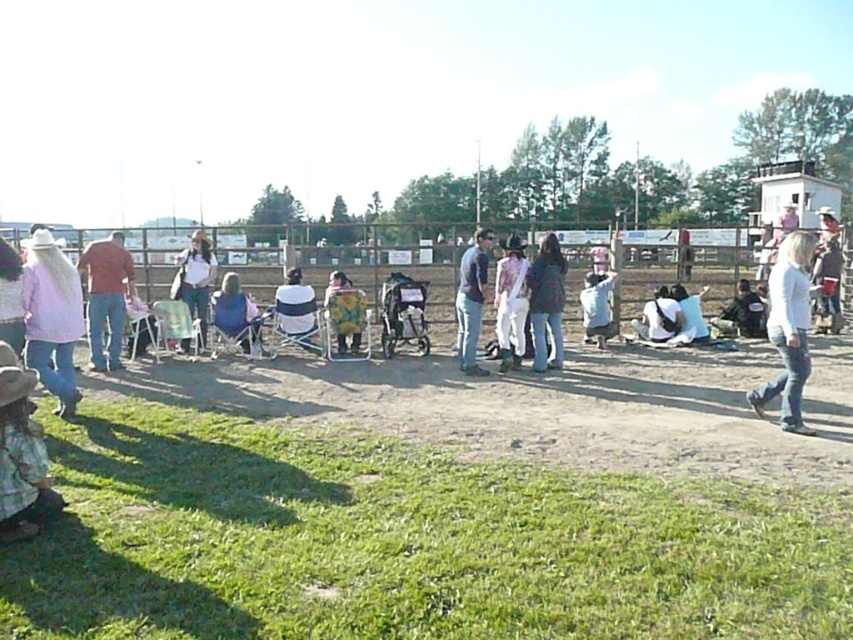
Question: Is denim jacket at center thinner than silver metallic stroller at center?

Choices:
 (A) no
 (B) yes

Answer: (B)

Question: Among these objects, which one is nearest to the camera?

Choices:
 (A) matte brown shirt at center
 (B) blue denim jeans at center

Answer: (B)

Question: Which point is farther to the camera?

Choices:
 (A) floral fabric pants at center
 (B) blue fabric chair at center

Answer: (B)

Question: Is white striped shirt at center closer to the viewer compared to white cotton shirt at center?

Choices:
 (A) no
 (B) yes

Answer: (B)

Question: Which object is farther from the camera taking this photo?

Choices:
 (A) pastel pink sweater at left
 (B) floral fabric pants at center
 (C) denim jacket at center

Answer: (C)

Question: Does white cotton shirt at right lie behind blue fabric chair at center?

Choices:
 (A) yes
 (B) no

Answer: (B)